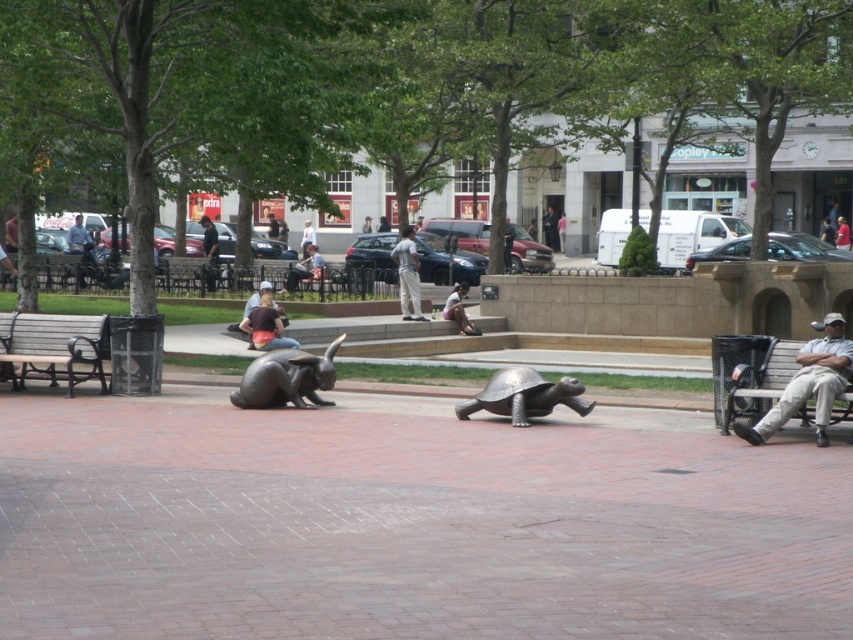
Question: Does bronze tortoise at center appear over light brown wooden bench at center?

Choices:
 (A) no
 (B) yes

Answer: (A)

Question: Estimate the real-world distances between objects in this image. Which object is farther from the light brown wooden bench at center?

Choices:
 (A) light brown wooden bench at right
 (B) light gray pants at center

Answer: (A)

Question: Among these points, which one is farthest from the camera?

Choices:
 (A) (32, 321)
 (B) (270, 369)
 (C) (305, 234)
 (D) (460, 316)

Answer: (C)

Question: Is wooden bench at left wider than light brown leather jacket at center?

Choices:
 (A) no
 (B) yes

Answer: (B)

Question: Among these points, which one is farthest from the camera?

Choices:
 (A) (315, 397)
 (B) (824, 333)
 (C) (445, 310)
 (D) (498, 385)

Answer: (C)

Question: Is wooden bench at left behind light brown wooden bench at center?

Choices:
 (A) yes
 (B) no

Answer: (B)